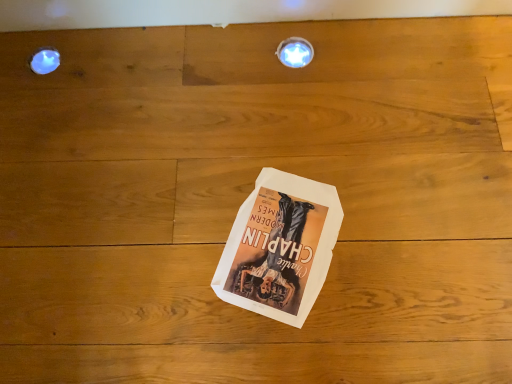
Find the location of a particular element. vacant space in front of white paper at center is located at coordinates (302, 342).